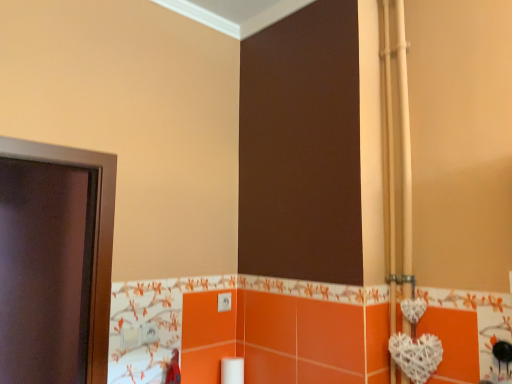
The width and height of the screenshot is (512, 384). What do you see at coordinates (224, 302) in the screenshot?
I see `white plastic switch at upper center` at bounding box center [224, 302].

The image size is (512, 384). I want to click on white plastic switch at upper center, so click(224, 302).

This screenshot has width=512, height=384. What are the coordinates of `white plastic switch at upper center` in the screenshot? It's located at coord(224,302).